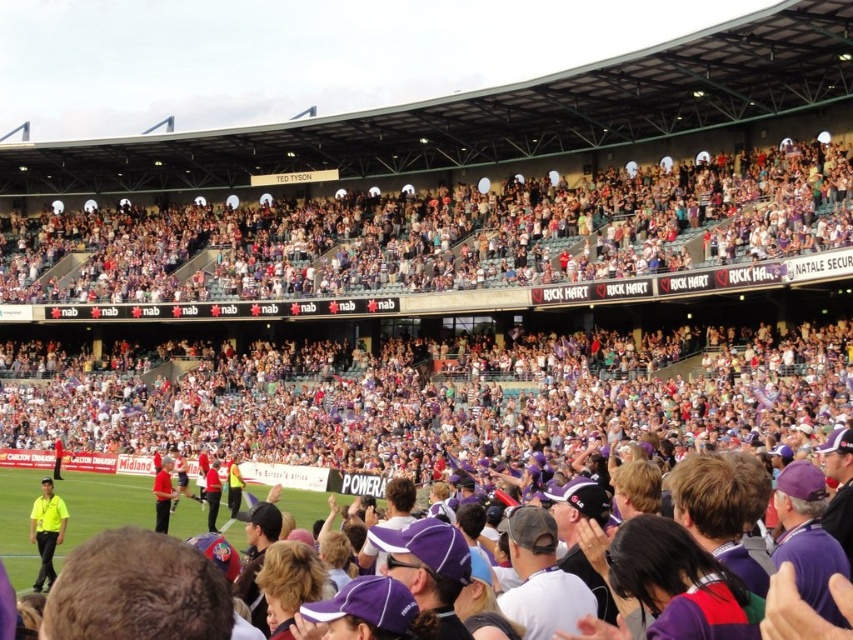
You are a photographer standing at the edge of the field. You want to take a photo that includes both the yellow shirt at lower left and the matte red shirt at center. Which shirt should you focus on first to ensure both are in clear view?

You should focus on the yellow shirt at lower left first because it is closer to the viewer than the matte red shirt at center, so adjusting focus from near to far will help both shirts be in clear view.

You are standing at the center of the stadium field and see a person wearing a yellow shirt at lower left. If you want to throw a ball to that person, and the maximum distance you can throw is 160 feet, will you be able to reach them?

The yellow shirt at lower left and the viewer are 170.35 feet apart, which is beyond the maximum throwing distance of 160 feet. Therefore, you will not be able to reach them by throwing the ball.